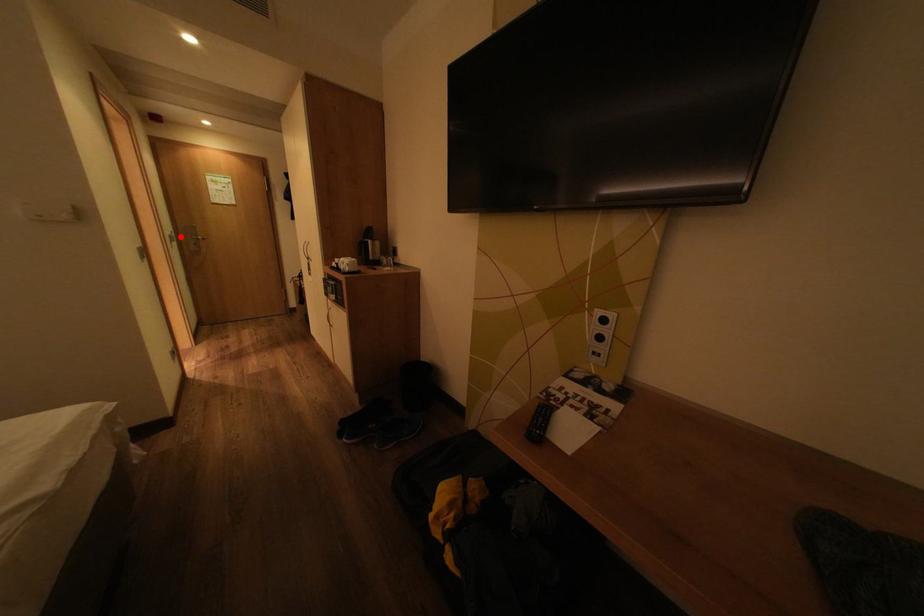
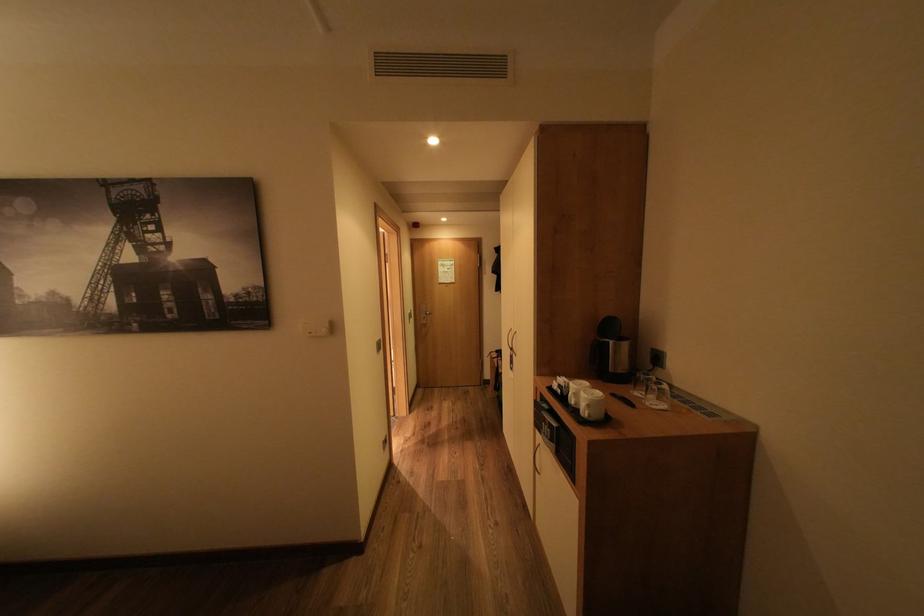
Find the pixel in the second image that matches the highlighted location in the first image.

(419, 315)